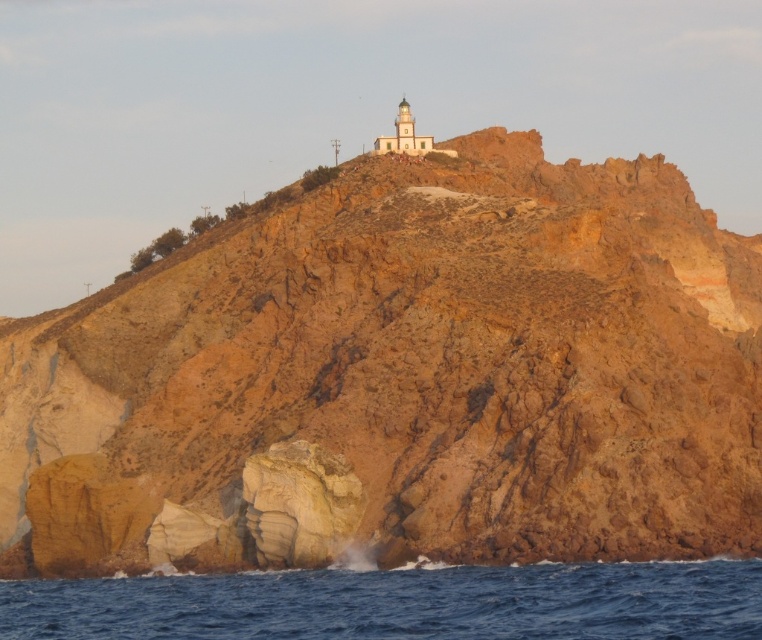
You are standing at the base of the cliff and want to reach the lighthouse. A drone is available to fly to the point marked at coordinates point (x=639, y=218). If the drone can travel 500 feet before needing to recharge, will it be able to reach the point without needing to recharge?

The distance of point (x=639, y=218) from the camera is 500.26 feet. Since the drone can travel 500 feet before needing to recharge, it will not be able to reach the point without recharging.

Based on the scene description, where is the rustic rock cliff at upper center located in terms of coordinates?

The rustic rock cliff at upper center is located at coordinates approximately at point (x=402, y=378).

You are a photographer planning to capture the rustic rock cliff at upper center and the blue water at lower center in a single frame. Considering their sizes, which object should you focus on to ensure both are visible without cropping?

The rustic rock cliff at upper center is bigger than the blue water at lower center, so you should focus on the rustic rock cliff at upper center to ensure both are visible without cropping.